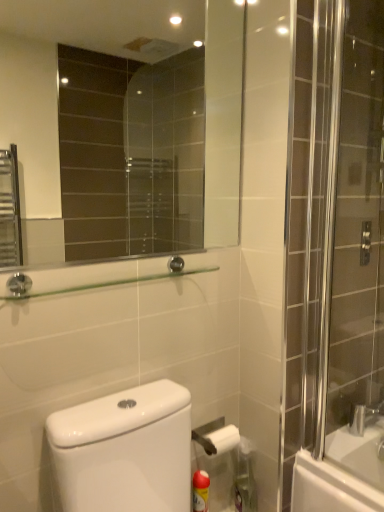
Question: Is clear glass mirror at upper center bigger than clear glass shower door at right?

Choices:
 (A) yes
 (B) no

Answer: (B)

Question: Is there a large distance between clear glass mirror at upper center and clear glass shower door at right?

Choices:
 (A) yes
 (B) no

Answer: (A)

Question: Is clear glass mirror at upper center shorter than clear glass shower door at right?

Choices:
 (A) yes
 (B) no

Answer: (A)

Question: Is clear glass mirror at upper center closer to the viewer compared to clear glass shower door at right?

Choices:
 (A) yes
 (B) no

Answer: (A)

Question: Considering the relative sizes of clear glass mirror at upper center and clear glass shower door at right in the image provided, is clear glass mirror at upper center smaller than clear glass shower door at right?

Choices:
 (A) no
 (B) yes

Answer: (B)

Question: In terms of height, does clear glass shower door at right look taller or shorter compared to yellow matte cleaning product at lower center, placed as the 1th cleaning product when sorted from left to right?

Choices:
 (A) tall
 (B) short

Answer: (A)

Question: Is clear glass shower door at right wider or thinner than yellow matte cleaning product at lower center, placed as the 1th cleaning product when sorted from left to right?

Choices:
 (A) wide
 (B) thin

Answer: (B)

Question: Is clear glass shower door at right in front of or behind yellow matte cleaning product at lower center, the 2th cleaning product viewed from the right, in the image?

Choices:
 (A) front
 (B) behind

Answer: (A)

Question: Is clear glass shower door at right spatially inside yellow matte cleaning product at lower center, the 2th cleaning product viewed from the right, or outside of it?

Choices:
 (A) outside
 (B) inside

Answer: (A)

Question: Considering the positions of yellow matte cleaning product at lower center, placed as the 1th cleaning product when sorted from left to right, and yellow plastic spray can at lower right, positioned as the 1th cleaning product in right-to-left order, in the image, is yellow matte cleaning product at lower center, placed as the 1th cleaning product when sorted from left to right, wider or thinner than yellow plastic spray can at lower right, positioned as the 1th cleaning product in right-to-left order,?

Choices:
 (A) wide
 (B) thin

Answer: (B)

Question: From a real-world perspective, is yellow matte cleaning product at lower center, the 2th cleaning product viewed from the right, physically located above or below yellow plastic spray can at lower right, which is counted as the second cleaning product, starting from the left?

Choices:
 (A) below
 (B) above

Answer: (A)

Question: From their relative heights in the image, would you say yellow matte cleaning product at lower center, placed as the 1th cleaning product when sorted from left to right, is taller or shorter than yellow plastic spray can at lower right, positioned as the 1th cleaning product in right-to-left order?

Choices:
 (A) short
 (B) tall

Answer: (A)

Question: Is point (193, 494) positioned closer to the camera than point (248, 494)?

Choices:
 (A) farther
 (B) closer

Answer: (B)

Question: Is clear glass shower door at right to the left or to the right of clear glass shelf at upper center in the image?

Choices:
 (A) left
 (B) right

Answer: (B)

Question: In terms of size, does clear glass shower door at right appear bigger or smaller than clear glass shelf at upper center?

Choices:
 (A) small
 (B) big

Answer: (B)